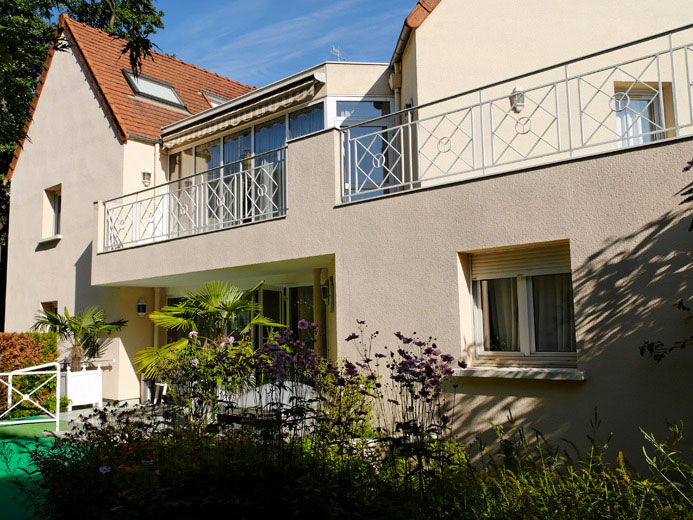
Where is `curtain`? curtain is located at coordinates (558, 304).